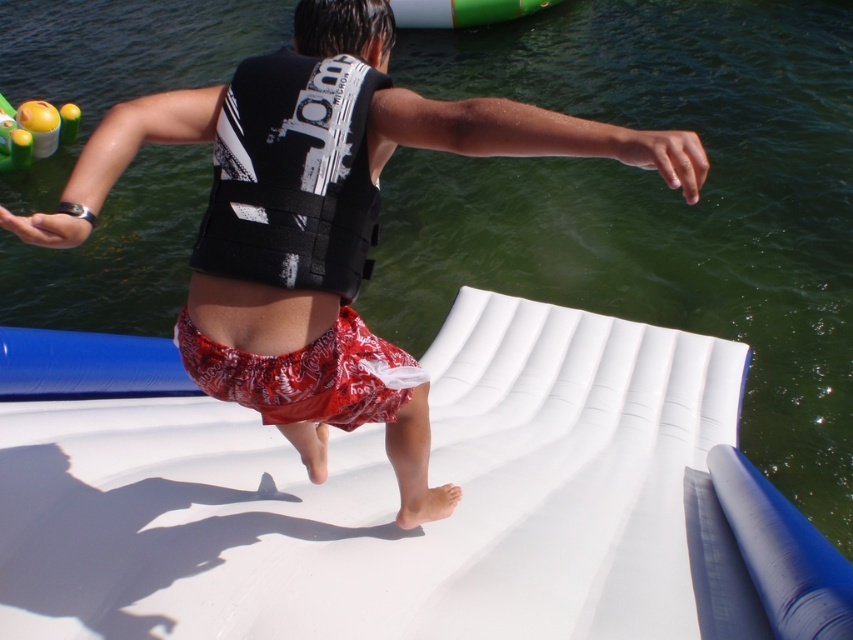
Question: Where is black matte life jacket at center located in relation to red printed shorts at center in the image?

Choices:
 (A) above
 (B) below

Answer: (A)

Question: Which point is closer to the camera taking this photo?

Choices:
 (A) (173, 435)
 (B) (357, 96)
 (C) (305, 417)
 (D) (386, 109)

Answer: (D)

Question: Where is white rubber boat at center located in relation to red printed shorts at center in the image?

Choices:
 (A) below
 (B) above

Answer: (A)

Question: Which object appears closest to the camera in this image?

Choices:
 (A) white rubber boat at center
 (B) red printed shorts at center

Answer: (A)

Question: Is black matte life jacket at center thinner than red printed shorts at center?

Choices:
 (A) no
 (B) yes

Answer: (B)

Question: Which point appears closest to the camera in this image?

Choices:
 (A) (320, 547)
 (B) (700, 150)
 (C) (219, 266)
 (D) (384, 353)

Answer: (B)